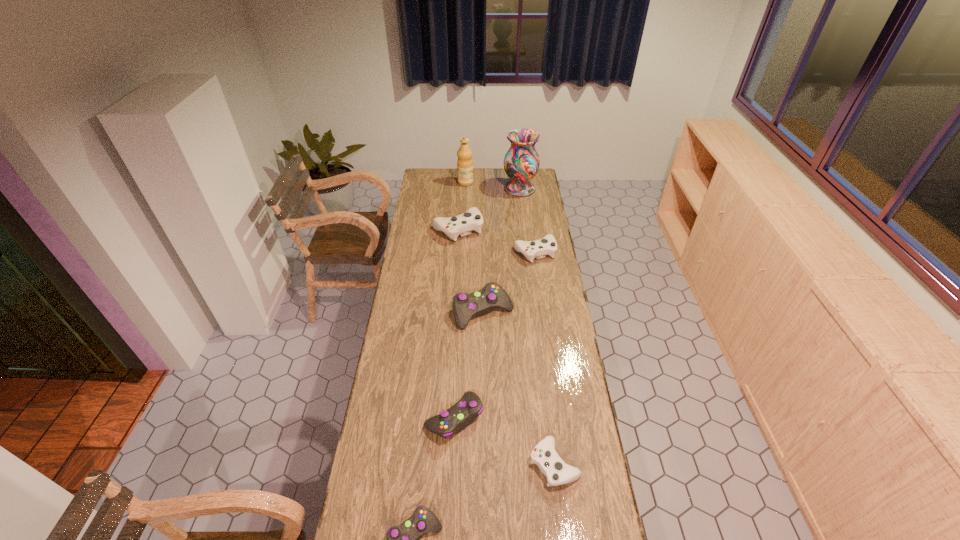
At what (x,y) coordinates should I click in order to perform the action: click on the tallest object. Please return your answer as a coordinate pair (x, y). Image resolution: width=960 pixels, height=540 pixels. Looking at the image, I should click on (521, 162).

At what (x,y) coordinates should I click in order to perform the action: click on olive oil. Please return your answer as a coordinate pair (x, y). This screenshot has height=540, width=960. Looking at the image, I should click on (464, 162).

Find the location of a particular element. The image size is (960, 540). the biggest white control is located at coordinates (463, 224).

Locate an element on the screen. The width and height of the screenshot is (960, 540). the farthest gray control is located at coordinates (465, 306).

Image resolution: width=960 pixels, height=540 pixels. I want to click on the fourth nearest control, so click(465, 306).

Where is `the second biggest white control`? the second biggest white control is located at coordinates (547, 245).

Identify the location of the second farthest gray control. The height and width of the screenshot is (540, 960). (452, 421).

I want to click on the nearest white control, so click(x=557, y=472).

Image resolution: width=960 pixels, height=540 pixels. Identify the location of free region located on the front of the tallest object. (522, 209).

I want to click on vacant space located on the label of the second tallest object, so click(515, 183).